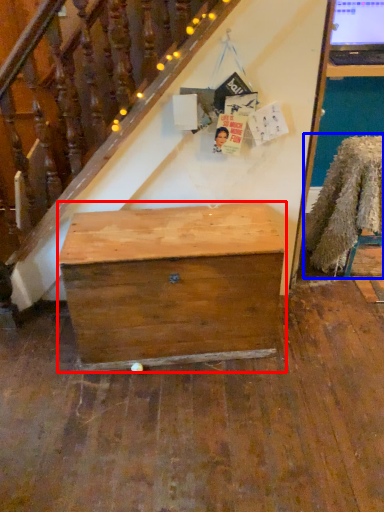
Question: Among these objects, which one is farthest to the camera, desk (highlighted by a red box) or chair (highlighted by a blue box)?

Choices:
 (A) desk
 (B) chair

Answer: (B)